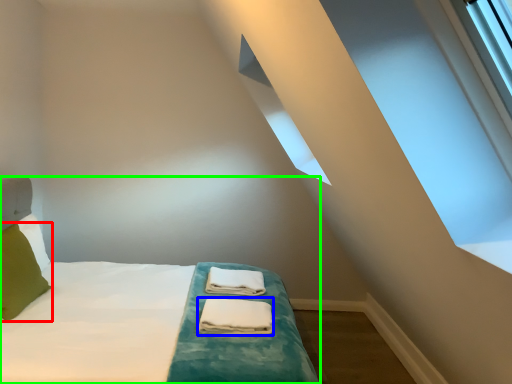
Question: Which object is positioned farthest from pillow (highlighted by a red box)? Select from material (highlighted by a blue box) and bed (highlighted by a green box).

Choices:
 (A) material
 (B) bed

Answer: (A)